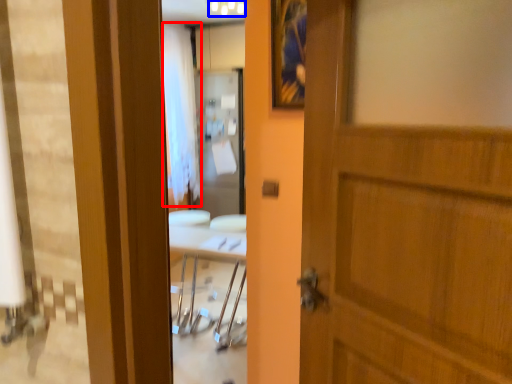
Question: Which point is further to the camera, curtain (highlighted by a red box) or light fixture (highlighted by a blue box)?

Choices:
 (A) curtain
 (B) light fixture

Answer: (A)